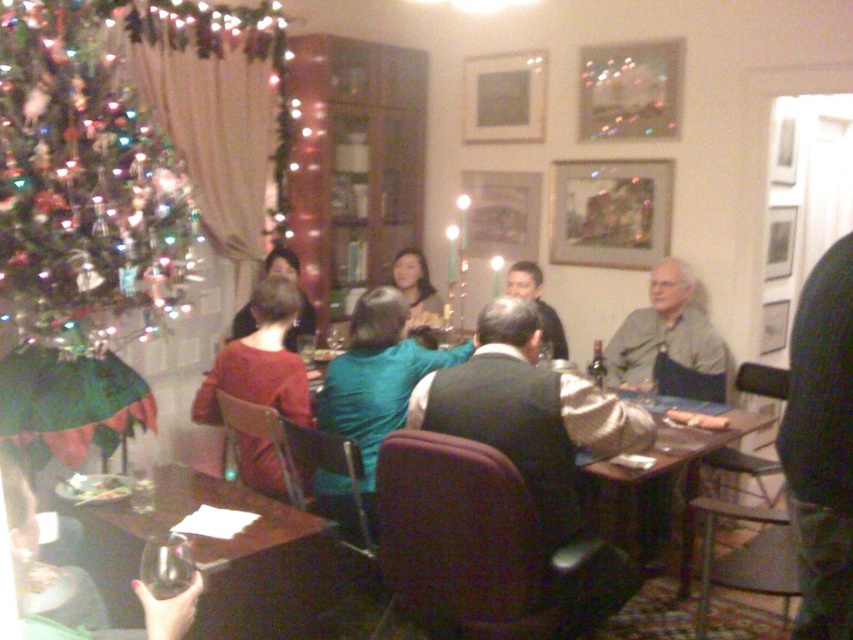
Consider the image. You are a guest at the holiday gathering and want to place a small gift under the Christmas tree. You have a matte brown sweater at center and a wooden table at center in your way. Which object do you need to move to reach the Christmas tree?

The matte brown sweater at center is taller than the wooden table at center, so you need to move the matte brown sweater at center to reach the Christmas tree.

You are a guest at the holiday gathering and want to reach for the translucent glass wine glass at lower left without disturbing the matte teal sweater at center. Can you easily access it from your current position?

The translucent glass wine glass at lower left is in front of the matte teal sweater at center, so you can easily access it without disturbing the sweater.

You are a guest at the holiday gathering and want to sit between the dark blue sweater at center and the matte teal sweater at center. Which sweater should you sit closer to if you want to have more space between you and the taller sweater?

The dark blue sweater at center is taller than the matte teal sweater at center. To have more space between you and the taller sweater, you should sit closer to the matte teal sweater at center.